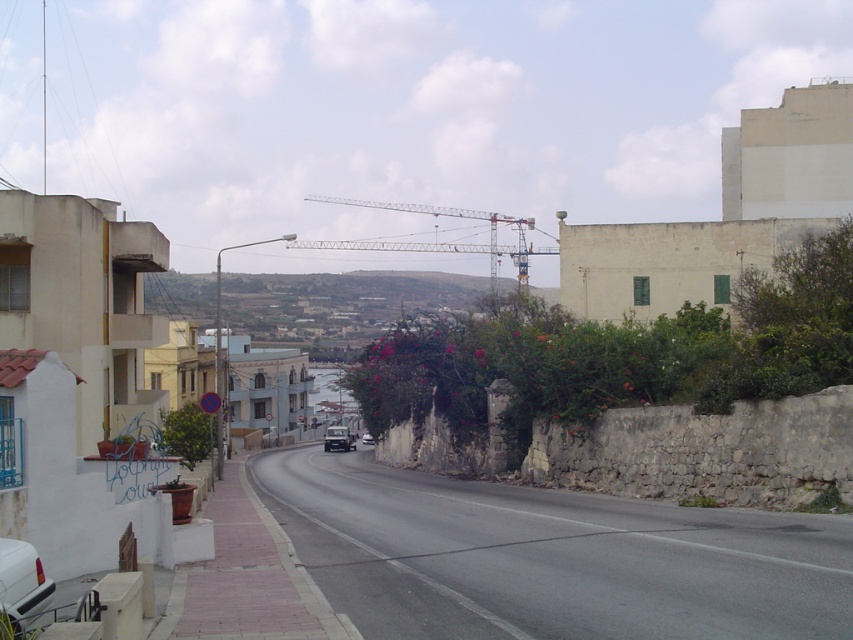
Question: Which point appears farthest from the camera in this image?

Choices:
 (A) (334, 445)
 (B) (306, 196)
 (C) (16, 579)
 (D) (370, 435)

Answer: (B)

Question: Is metallic gray crane at center closer to camera compared to matte black car at center?

Choices:
 (A) yes
 (B) no

Answer: (A)

Question: Which of the following is the closest to the observer?

Choices:
 (A) white matte car at lower left
 (B) white glossy car at center
 (C) matte black car at center

Answer: (A)

Question: Which object is closer to the camera taking this photo?

Choices:
 (A) metallic gray crane at center
 (B) white glossy car at center
 (C) matte black car at center
 (D) white matte car at lower left

Answer: (D)

Question: Is white matte car at lower left to the left of matte black car at center from the viewer's perspective?

Choices:
 (A) no
 (B) yes

Answer: (A)

Question: Can you confirm if white matte car at lower left is positioned to the right of matte black car at center?

Choices:
 (A) yes
 (B) no

Answer: (A)